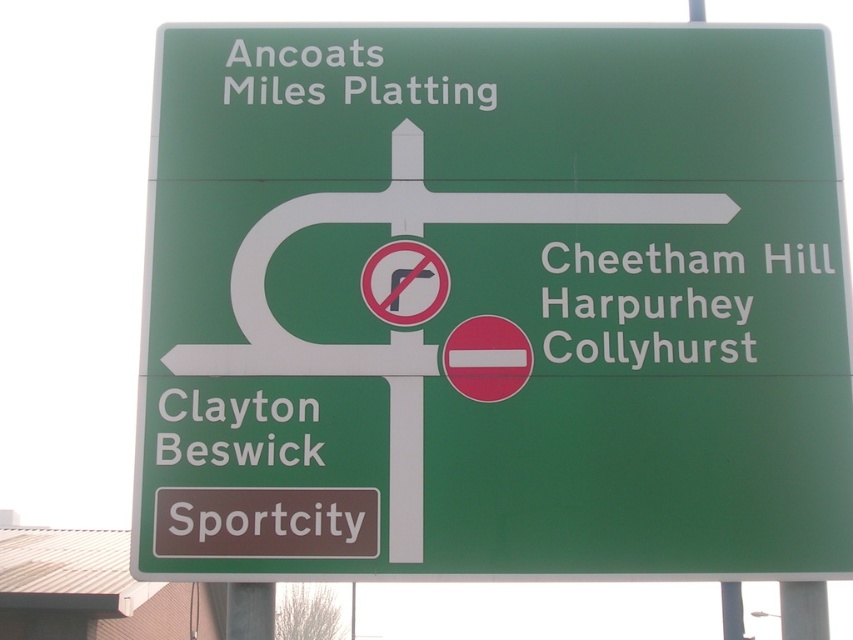
Question: Which of these objects is positioned closest to the white text on green sign at upper center?

Choices:
 (A) white text on green sign at right
 (B) green matte sign at upper center

Answer: (B)

Question: Which object is farther from the camera taking this photo?

Choices:
 (A) white text on green sign at upper center
 (B) green matte sign at upper center

Answer: (A)

Question: Is green matte sign at upper center further to the viewer compared to white text on green sign at right?

Choices:
 (A) no
 (B) yes

Answer: (A)

Question: Does green matte sign at upper center have a larger size compared to white text on green sign at upper center?

Choices:
 (A) yes
 (B) no

Answer: (A)

Question: Which is nearer to the green matte sign at upper center?

Choices:
 (A) white text on green sign at right
 (B) white text on green sign at upper center

Answer: (A)

Question: Can you confirm if green matte sign at upper center is positioned above white text on green sign at right?

Choices:
 (A) no
 (B) yes

Answer: (B)